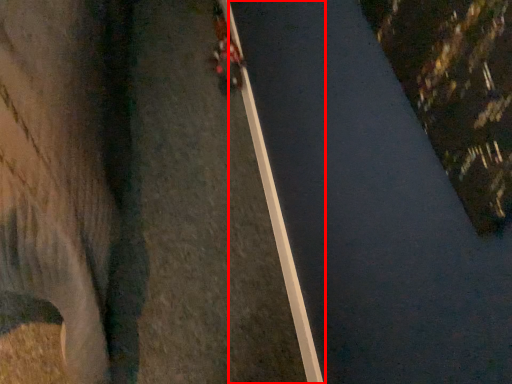
Question: Considering the relative positions of curb (annotated by the red box) and vehicle in the image provided, where is curb (annotated by the red box) located with respect to the staircase?

Choices:
 (A) right
 (B) left

Answer: (A)